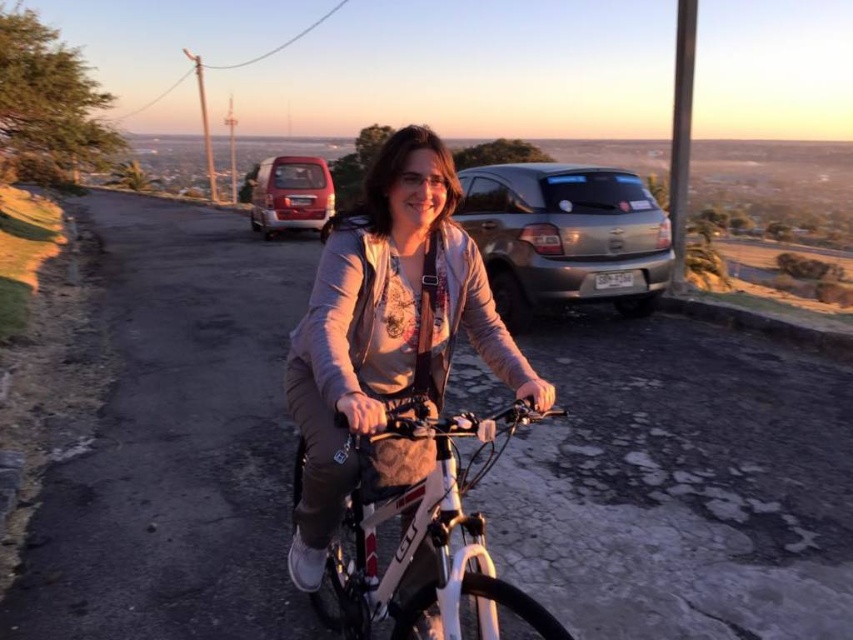
You are standing at the starting point of the road and want to reach the satin silver suv at upper center. Which direction should you head towards?

The satin silver suv at upper center is located at point [566,236], so you should head towards the upper center direction to reach it.

You are a pedestrian standing at the edge of the road and see the matte gray jacket at center and the satin silver suv at upper center. Which object appears smaller in the scene?

The matte gray jacket at center appears smaller compared to the satin silver suv at upper center.

You are a pedestrian standing on the road and see the matte gray jacket at center and the metallic red van at upper left. Which object is closer to you?

The matte gray jacket at center is closer to you because it is in front of the metallic red van at upper left.